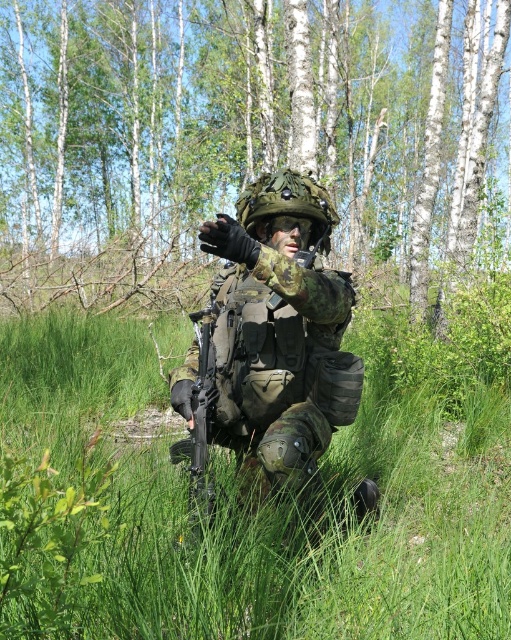
Question: Considering the real-world distances, which object is farthest from the green matte grass at center?

Choices:
 (A) matte black rifle at center
 (B) camouflage fabric uniform at center

Answer: (A)

Question: Does green matte grass at center appear on the right side of camouflage fabric uniform at center?

Choices:
 (A) no
 (B) yes

Answer: (B)

Question: Which object is the closest to the green matte grass at center?

Choices:
 (A) matte black rifle at center
 (B) camouflage fabric uniform at center

Answer: (B)

Question: Which point appears closest to the camera in this image?

Choices:
 (A) (423, 477)
 (B) (211, 480)

Answer: (B)

Question: Is camouflage fabric uniform at center thinner than matte black rifle at center?

Choices:
 (A) no
 (B) yes

Answer: (A)

Question: Is camouflage fabric uniform at center further to the viewer compared to matte black rifle at center?

Choices:
 (A) no
 (B) yes

Answer: (A)